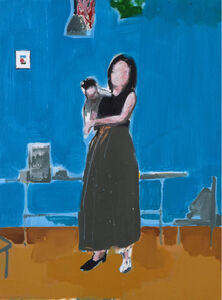
Find the location of a particular element. Image resolution: width=222 pixels, height=300 pixels. tiny wall painting is located at coordinates (23, 62).